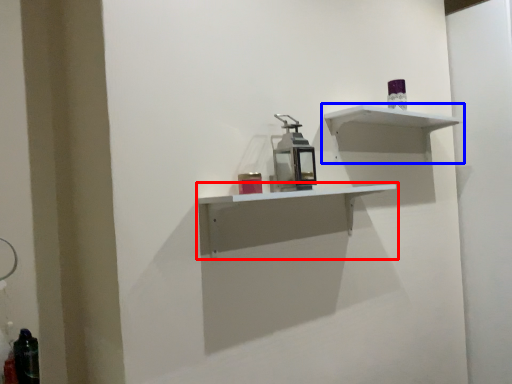
Question: Among these objects, which one is nearest to the camera, shelf (highlighted by a red box) or shelf (highlighted by a blue box)?

Choices:
 (A) shelf
 (B) shelf

Answer: (A)